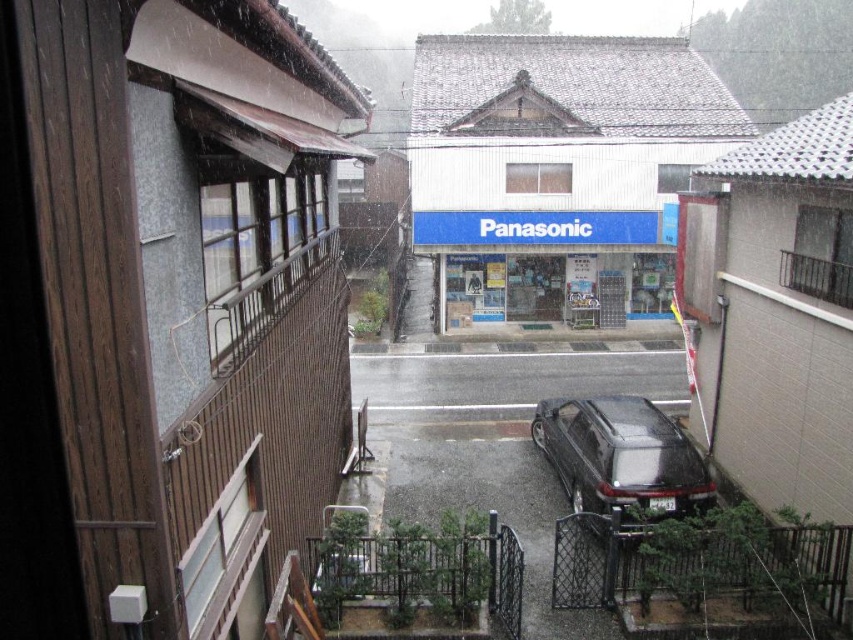
Question: Can you confirm if brown wood building at left is positioned to the right of white matte building at center?

Choices:
 (A) yes
 (B) no

Answer: (B)

Question: Among these objects, which one is farthest from the camera?

Choices:
 (A) glossy black car at lower center
 (B) white matte building at center
 (C) brown wood building at left

Answer: (B)

Question: Is brown wood building at left bigger than glossy black car at lower center?

Choices:
 (A) yes
 (B) no

Answer: (A)

Question: Which object is closer to the camera taking this photo?

Choices:
 (A) white matte building at center
 (B) brown wood building at left
 (C) glossy black car at lower center

Answer: (B)

Question: Which of the following is the farthest from the observer?

Choices:
 (A) brown wood building at left
 (B) glossy black car at lower center
 (C) white matte building at center

Answer: (C)

Question: Can you confirm if brown wood building at left is smaller than white matte building at center?

Choices:
 (A) yes
 (B) no

Answer: (A)